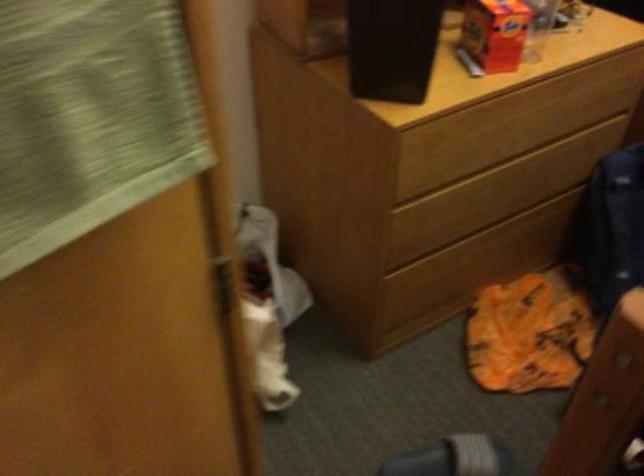
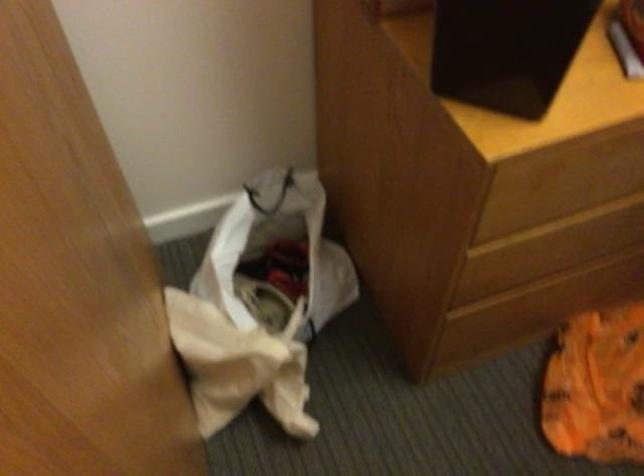
In the second image, find the point that corresponds to point (506, 338) in the first image.

(597, 386)